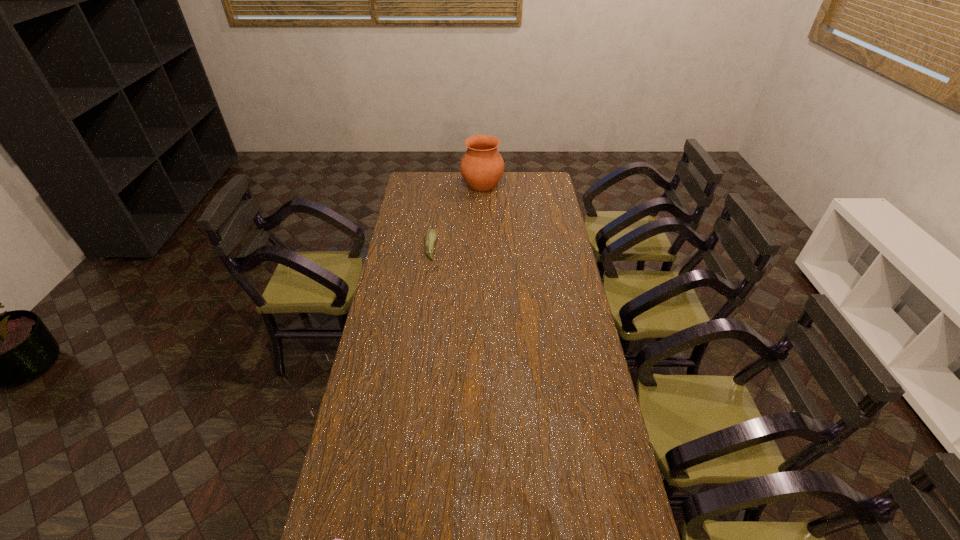
I want to click on free space at the right edge of the desktop, so click(x=548, y=321).

In the image, there is a desktop. In order to click on blank space at the far left corner in this screenshot , I will do `click(411, 188)`.

This screenshot has height=540, width=960. Identify the location of vacant space in between the second shortest object and the pottery. (456, 215).

Find the location of a particular element. vacant area between the second tallest object and the farthest object is located at coordinates (456, 215).

This screenshot has height=540, width=960. I want to click on vacant region between the rightmost object and the second shortest object, so pos(456,215).

The image size is (960, 540). In order to click on object that stands as the second closest to the nearest object in this screenshot , I will do `click(482, 166)`.

Choose which object is the nearest neighbor to the tallest object. Please provide its 2D coordinates. Your answer should be formatted as a tuple, i.e. [(x, y)], where the tuple contains the x and y coordinates of a point satisfying the conditions above.

[(431, 235)]